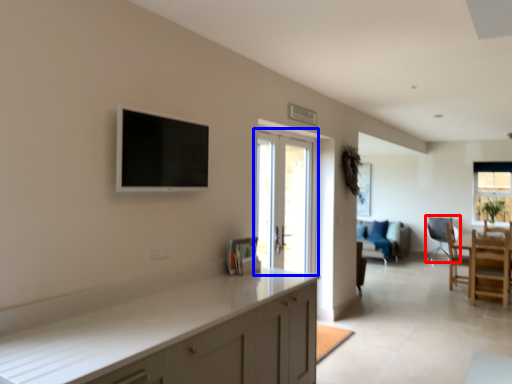
Question: Among these objects, which one is farthest to the camera, chair (highlighted by a red box) or door (highlighted by a blue box)?

Choices:
 (A) chair
 (B) door

Answer: (A)